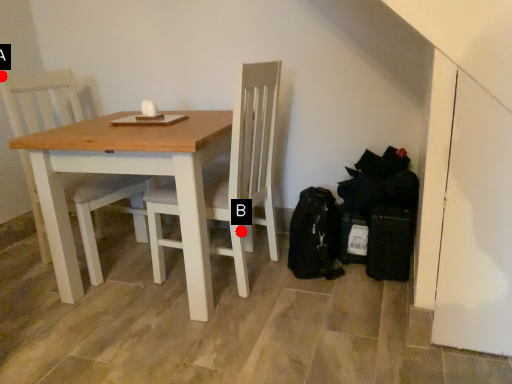
Question: Two points are circled on the image, labeled by A and B beside each circle. Which of the following is the farthest from the observer?

Choices:
 (A) A is further
 (B) B is further

Answer: (A)